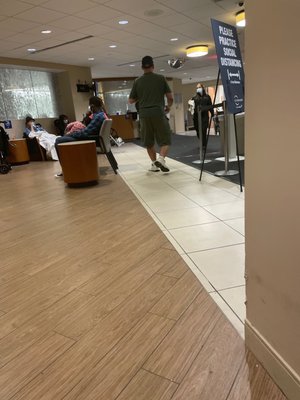
Locate an element on the screen. The image size is (300, 400). window is located at coordinates (20, 100).